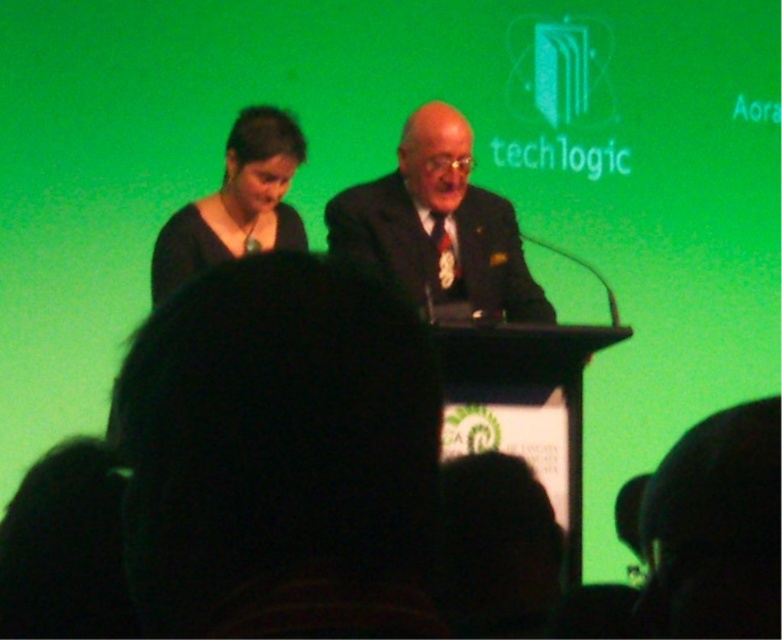
Is dark suit at center above matte black dress at upper left?

Incorrect, dark suit at center is not positioned above matte black dress at upper left.

Consider the image. Is dark suit at center wider than matte black dress at upper left?

Yes, dark suit at center is wider than matte black dress at upper left.

Locate an element on the screen. dark suit at center is located at coordinates (438, 225).

Identify the location of dark suit at center. (438, 225).